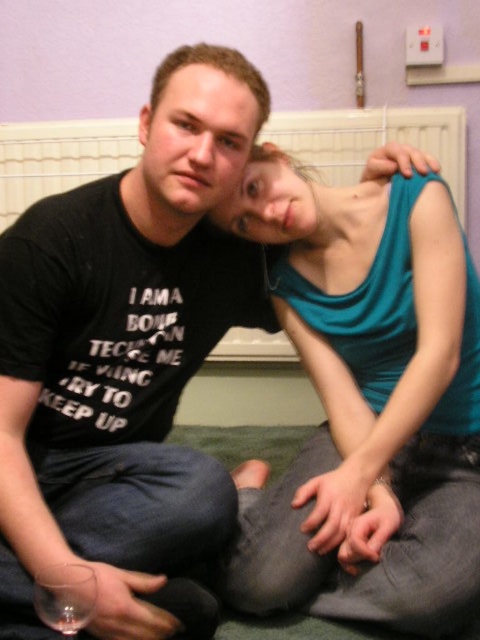
Question: Does teal fabric tank top at upper right appear on the right side of white plastic radiator at upper center?

Choices:
 (A) no
 (B) yes

Answer: (A)

Question: Does teal fabric tank top at upper right appear under white plastic radiator at upper center?

Choices:
 (A) yes
 (B) no

Answer: (A)

Question: Which of the following is the farthest from the observer?

Choices:
 (A) white plastic radiator at upper center
 (B) teal fabric tank top at upper right

Answer: (A)

Question: Which point is farther from the camera taking this photo?

Choices:
 (A) (276, 140)
 (B) (446, 490)

Answer: (A)

Question: Does teal fabric tank top at upper right have a greater width compared to white plastic radiator at upper center?

Choices:
 (A) no
 (B) yes

Answer: (A)

Question: Among these points, which one is farthest from the camera?

Choices:
 (A) (416, 349)
 (B) (112, 148)

Answer: (B)